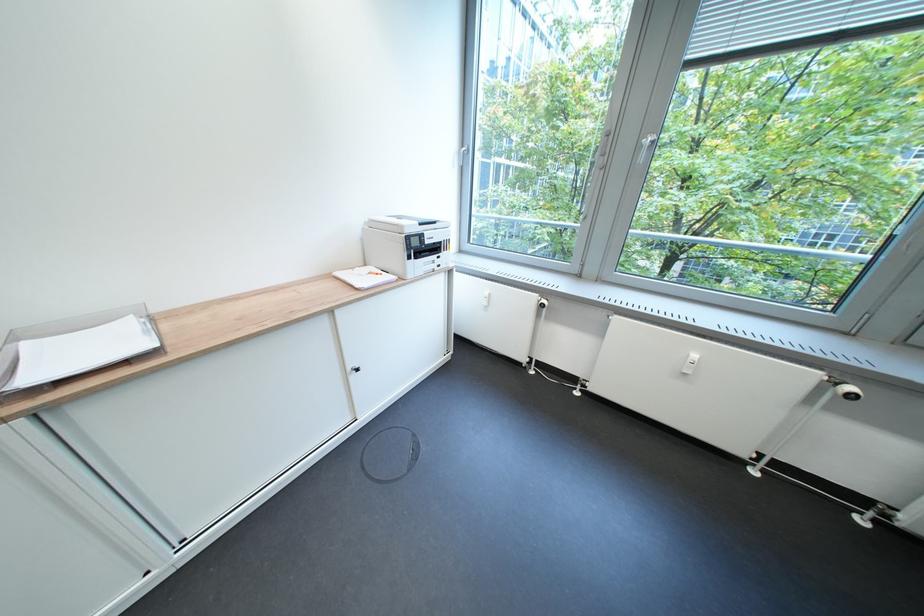
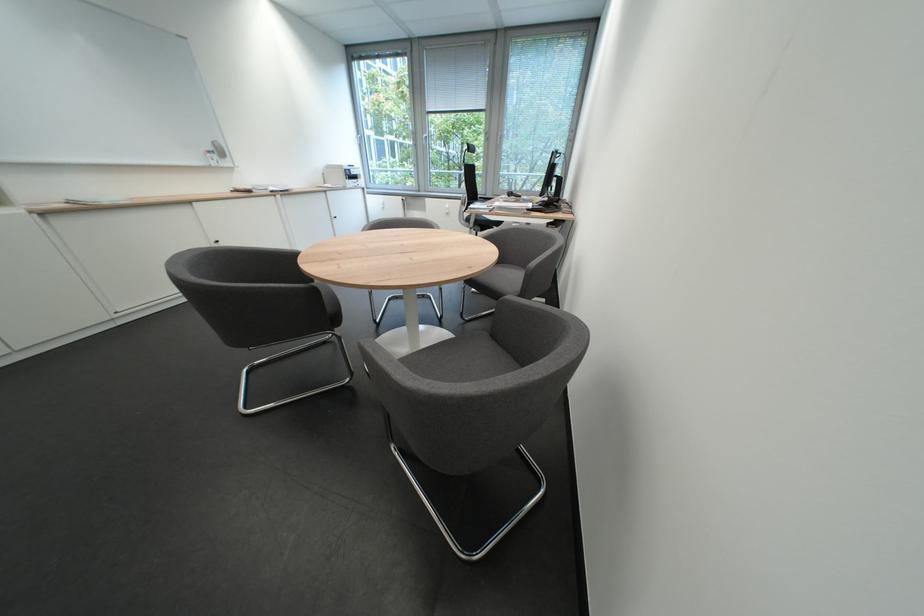
Question: The images are taken continuously from a first-person perspective. In which direction are you moving?

Choices:
 (A) Left
 (B) Right
 (C) Forward
 (D) Backward

Answer: (D)